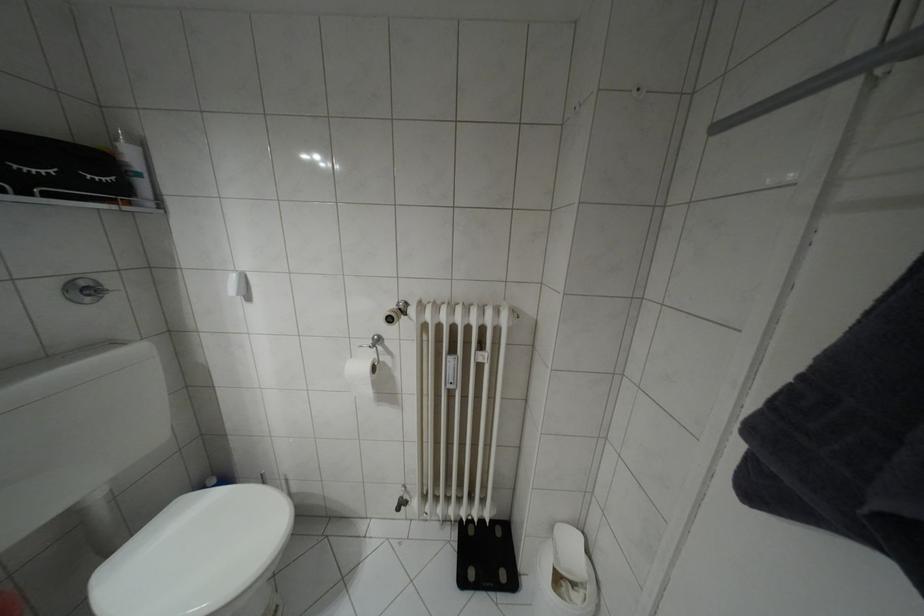
Which object does [61,169] point to?

It refers to a black toiletry bag.